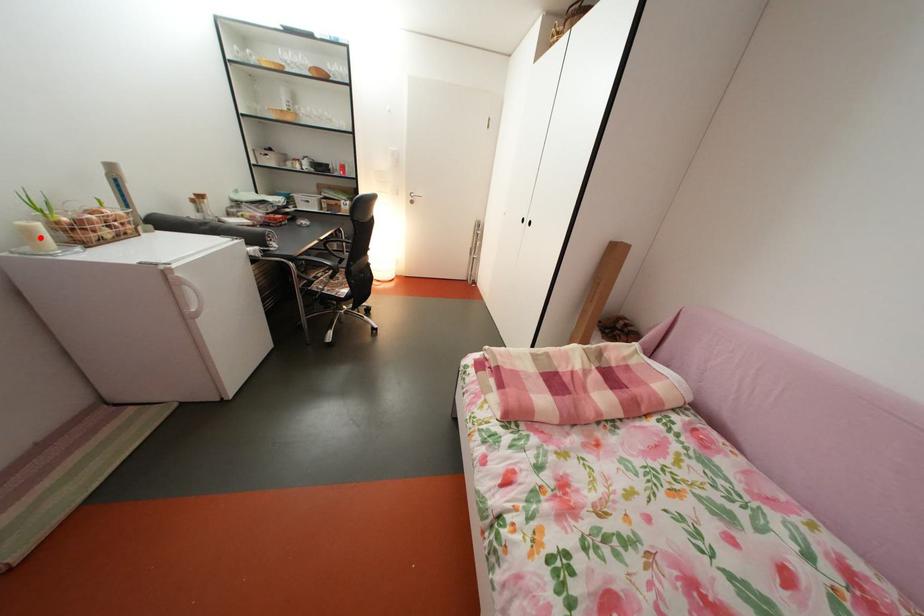
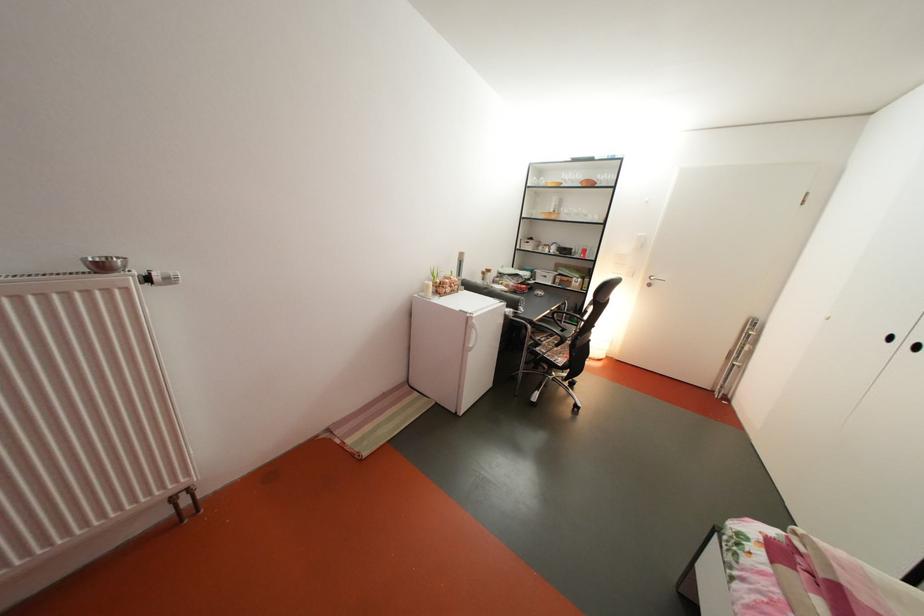
Find the pixel in the second image that matches the highlighted location in the first image.

(439, 293)